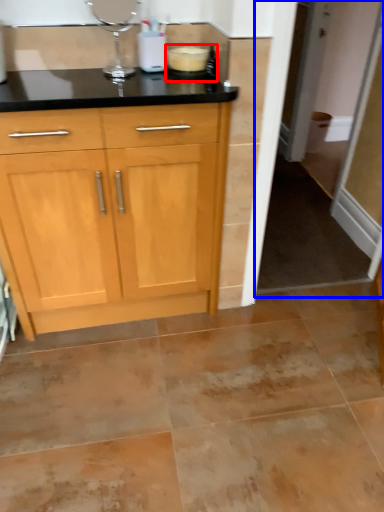
Question: Which object is further to the camera taking this photo, appliance (highlighted by a red box) or screen door (highlighted by a blue box)?

Choices:
 (A) appliance
 (B) screen door

Answer: (B)